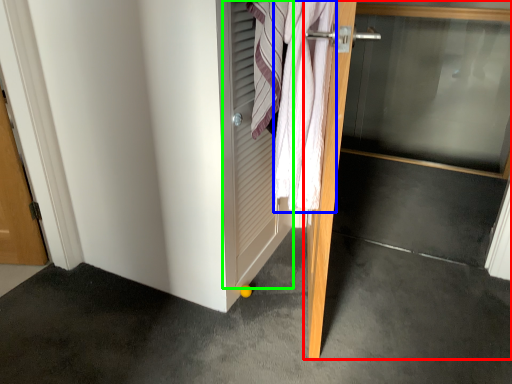
Question: Based on their relative distances, which object is farther from door (highlighted by a red box)? Choose from bath towel (highlighted by a blue box) and screen door (highlighted by a green box).

Choices:
 (A) bath towel
 (B) screen door

Answer: (B)